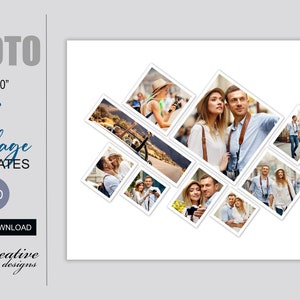
Find the location of a particular element. Image resolution: width=300 pixels, height=300 pixels. pictures is located at coordinates (111, 169), (134, 140), (155, 107), (213, 111), (291, 126), (273, 172), (221, 207), (181, 200), (133, 189).